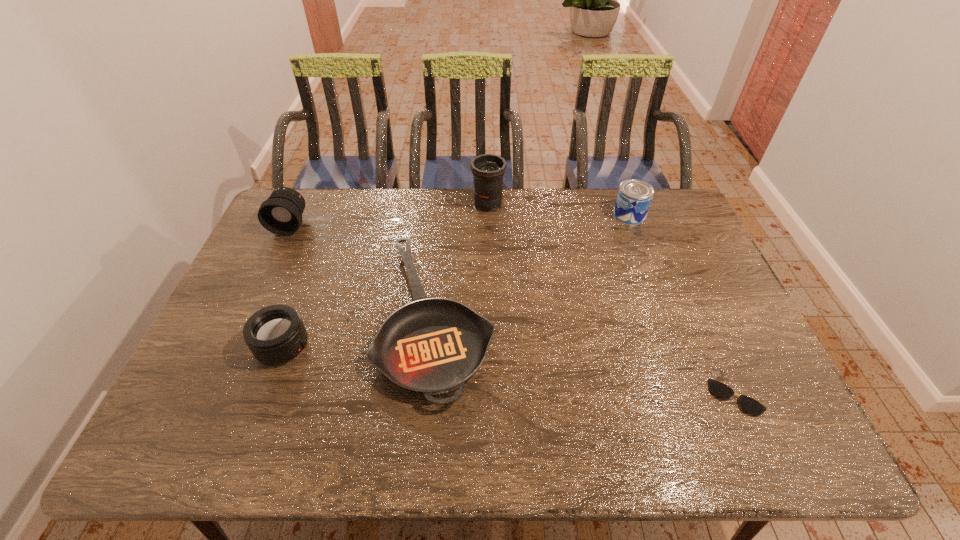
The width and height of the screenshot is (960, 540). Identify the location of free space that is in between the tallest telephoto lens and the second tallest object. (389, 214).

The width and height of the screenshot is (960, 540). In order to click on free space between the third shortest object and the second tallest telephoto lens in this screenshot , I will do `click(287, 286)`.

Locate an element on the screen. The image size is (960, 540). empty location between the fourth shortest object and the second shortest telephoto lens is located at coordinates (460, 220).

Where is `empty location between the can and the nearest telephoto lens`? The image size is (960, 540). empty location between the can and the nearest telephoto lens is located at coordinates (456, 281).

In order to click on empty space between the shortest object and the fifth tallest object in this screenshot , I will do `click(587, 357)`.

Where is `free point between the shortest object and the fifth shortest object`? Image resolution: width=960 pixels, height=540 pixels. free point between the shortest object and the fifth shortest object is located at coordinates (514, 311).

At what (x,y) coordinates should I click in order to perform the action: click on free point between the second shortest object and the fifth shortest object. Please return your answer as a coordinate pair (x, y). The image size is (960, 540). Looking at the image, I should click on (364, 271).

Where is `blank region between the spectacles and the tallest telephoto lens`? The width and height of the screenshot is (960, 540). blank region between the spectacles and the tallest telephoto lens is located at coordinates (612, 301).

Identify which object is the third closest to the third shortest object. Please provide its 2D coordinates. Your answer should be formatted as a tuple, i.e. [(x, y)], where the tuple contains the x and y coordinates of a point satisfying the conditions above.

[(487, 169)]

The width and height of the screenshot is (960, 540). Identify the location of object that is the second closest to the fourth tallest object. point(281,214).